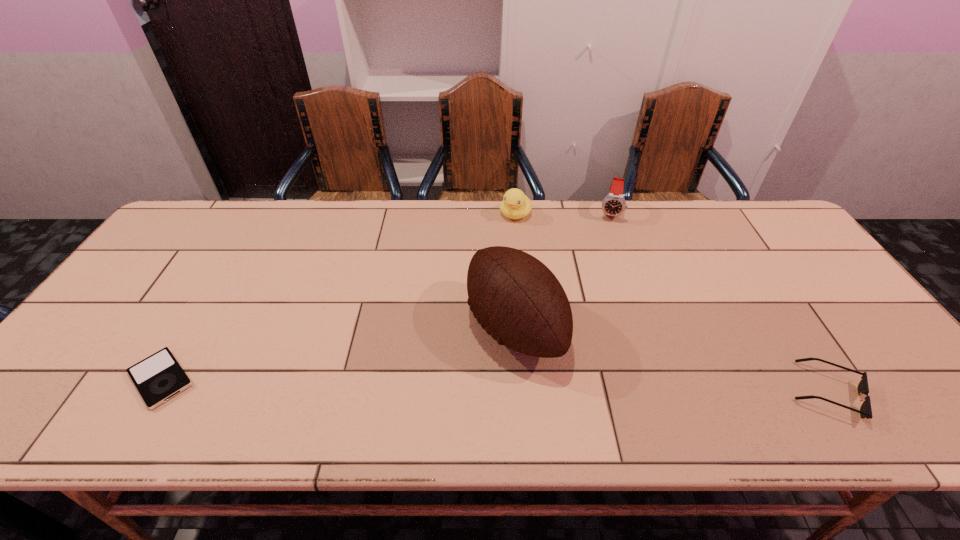
The width and height of the screenshot is (960, 540). I want to click on free area in between the iPod and the third tallest object, so click(x=338, y=296).

Where is `vacant area that lies between the fourth object from left to right and the tallest object`? The height and width of the screenshot is (540, 960). vacant area that lies between the fourth object from left to right and the tallest object is located at coordinates (562, 270).

At what (x,y) coordinates should I click in order to perform the action: click on free space between the shortest object and the third shortest object. Please return your answer as a coordinate pair (x, y). This screenshot has height=540, width=960. Looking at the image, I should click on (338, 296).

This screenshot has height=540, width=960. In order to click on empty space between the fourth object from left to right and the second shortest object in this screenshot , I will do `click(718, 302)`.

At what (x,y) coordinates should I click in order to perform the action: click on free space between the shortest object and the sunglasses. Please return your answer as a coordinate pair (x, y). The width and height of the screenshot is (960, 540). Looking at the image, I should click on (493, 386).

Image resolution: width=960 pixels, height=540 pixels. In order to click on empty space that is in between the fourth object from left to right and the tallest object in this screenshot , I will do (x=562, y=270).

Find the location of `empty space between the third shortest object and the rightmost object`. empty space between the third shortest object and the rightmost object is located at coordinates (671, 303).

Where is `free space that is in between the shortest object and the fourth object from left to right`? free space that is in between the shortest object and the fourth object from left to right is located at coordinates (385, 295).

Choose which object is the fourth nearest neighbor to the fourth tallest object. Please provide its 2D coordinates. Your answer should be formatted as a tuple, i.e. [(x, y)], where the tuple contains the x and y coordinates of a point satisfying the conditions above.

[(159, 377)]

Where is `object that can be found as the third closest to the third tallest object`? object that can be found as the third closest to the third tallest object is located at coordinates (865, 411).